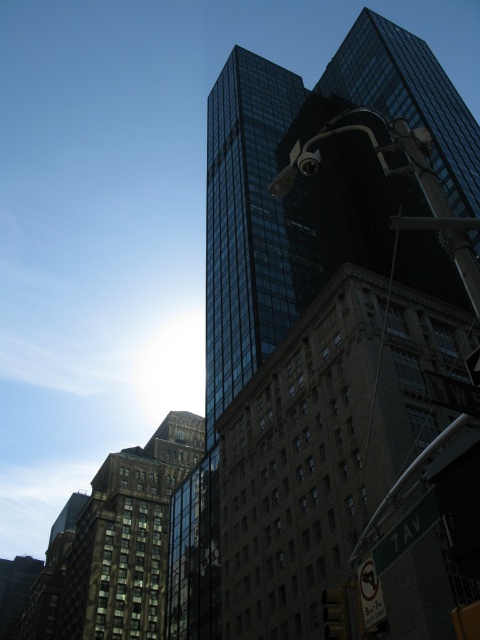
Question: Which point is closer to the camera?

Choices:
 (A) brown brick building at center
 (B) shiny glass skyscraper at center
 (C) green matte street sign at lower right

Answer: (B)

Question: Is brown brick building at center closer to camera compared to metallic silver traffic light at lower right?

Choices:
 (A) no
 (B) yes

Answer: (A)

Question: Which object appears closest to the camera in this image?

Choices:
 (A) shiny glass skyscraper at center
 (B) metallic silver traffic light at lower right

Answer: (A)

Question: Is brown brick building at center in front of green matte street sign at lower right?

Choices:
 (A) yes
 (B) no

Answer: (B)

Question: Can you confirm if brown brick building at center is bigger than metallic silver traffic light at lower right?

Choices:
 (A) no
 (B) yes

Answer: (B)

Question: Which of the following is the closest to the observer?

Choices:
 (A) (441, 628)
 (B) (429, 496)
 (C) (127, 547)
 (D) (348, 636)

Answer: (B)